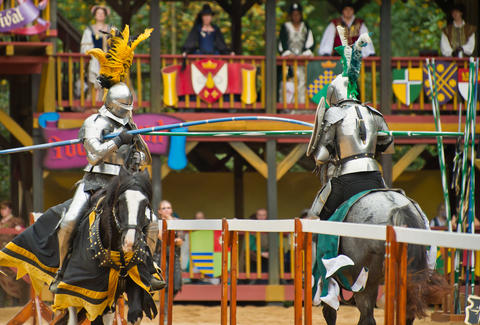
Find the location of `2nd floor viewing area`. 2nd floor viewing area is located at coordinates (395, 118).